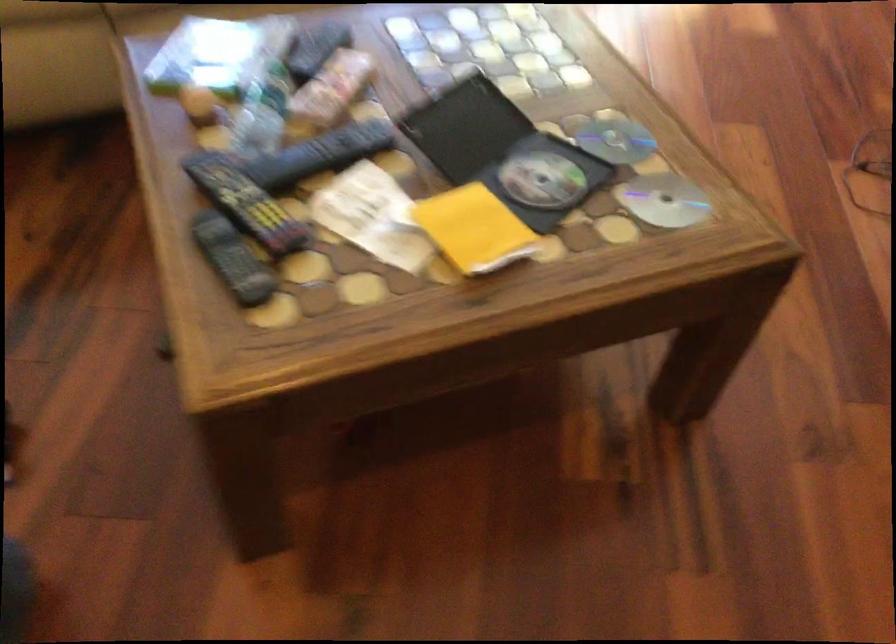
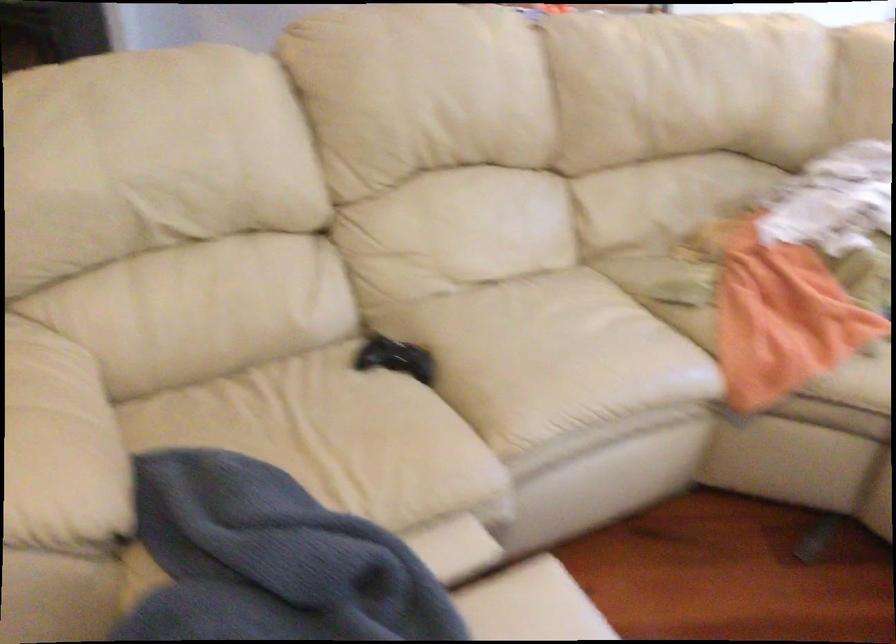
Question: The camera is either moving clockwise (left) or counter-clockwise (right) around the object. The first image is from the beginning of the video and the second image is from the end. Is the camera moving left or right when shooting the video?

Choices:
 (A) Left
 (B) Right

Answer: (B)